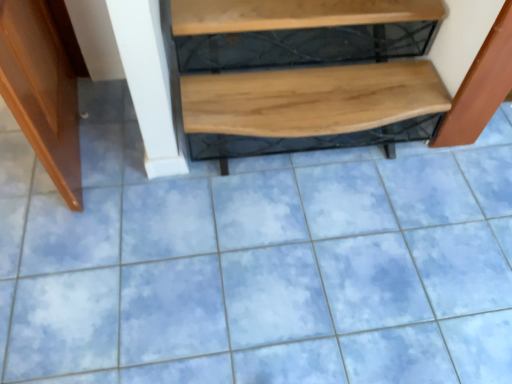
Image resolution: width=512 pixels, height=384 pixels. Identify the location of free space on the front side of wooden bench at right. (465, 182).